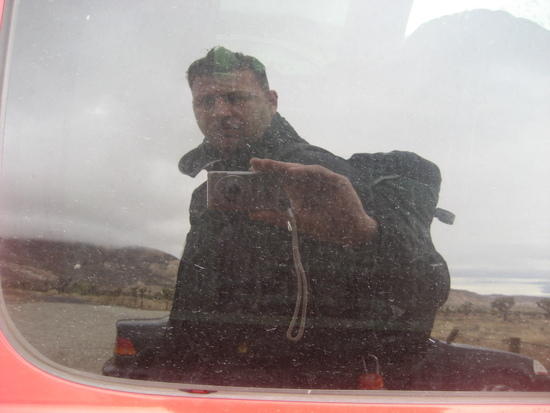
You are a GUI agent. You are given a task and a screenshot of the screen. Output one action in this format:
    pyautogui.click(x=<x>, y=<y>)
    Task: Click on the window
    This screenshot has height=413, width=550.
    Given the screenshot: What is the action you would take?
    tap(462, 113)